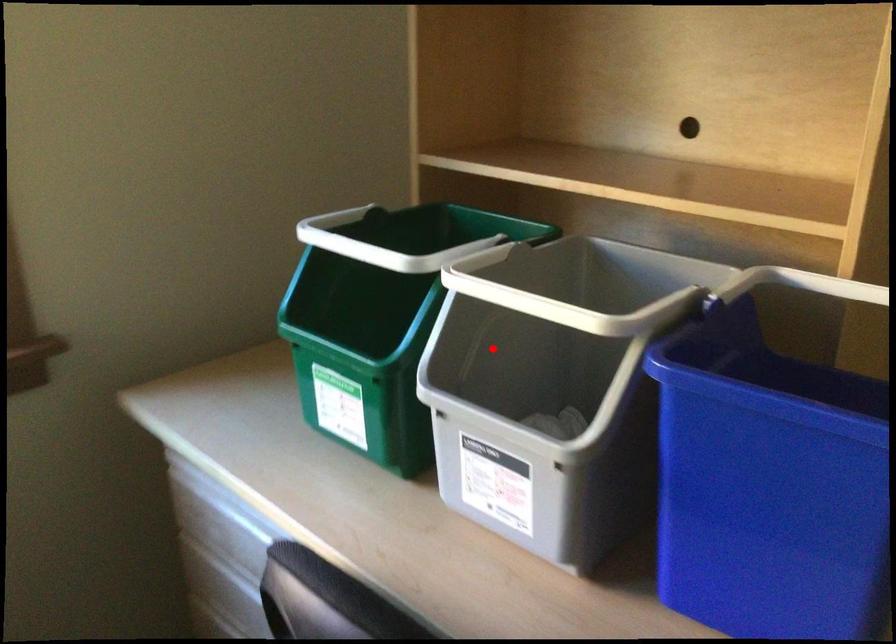
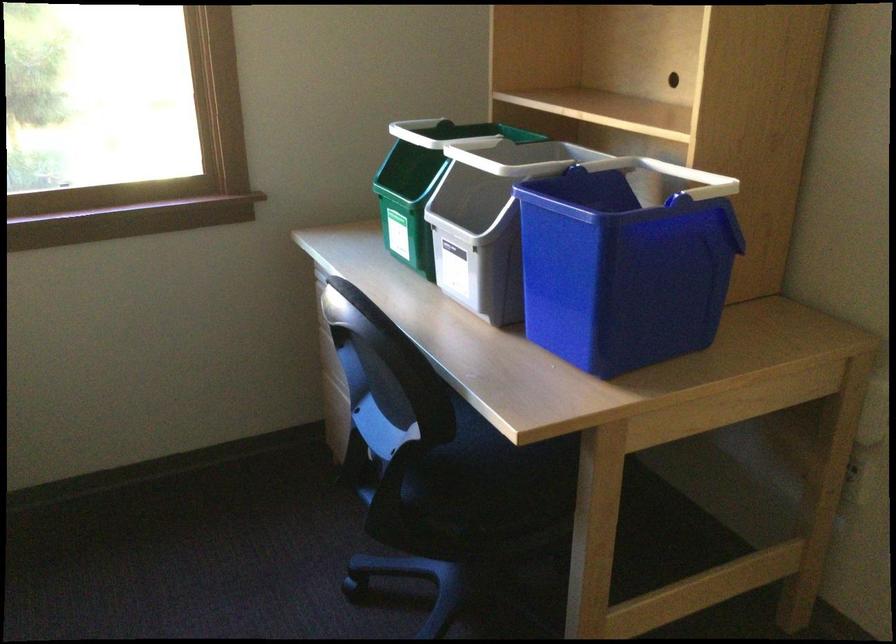
Question: I am providing you with two images of the same scene from different viewpoints. In image1, a red point is highlighted. Considering the same 3D point in image2, which of the following is correct?

Choices:
 (A) It is closer
 (B) It is farther

Answer: (B)